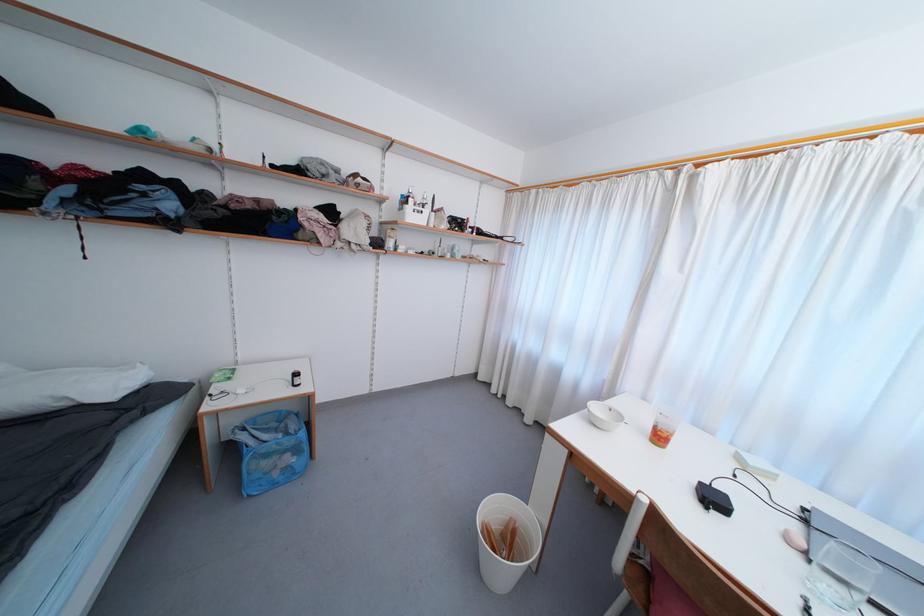
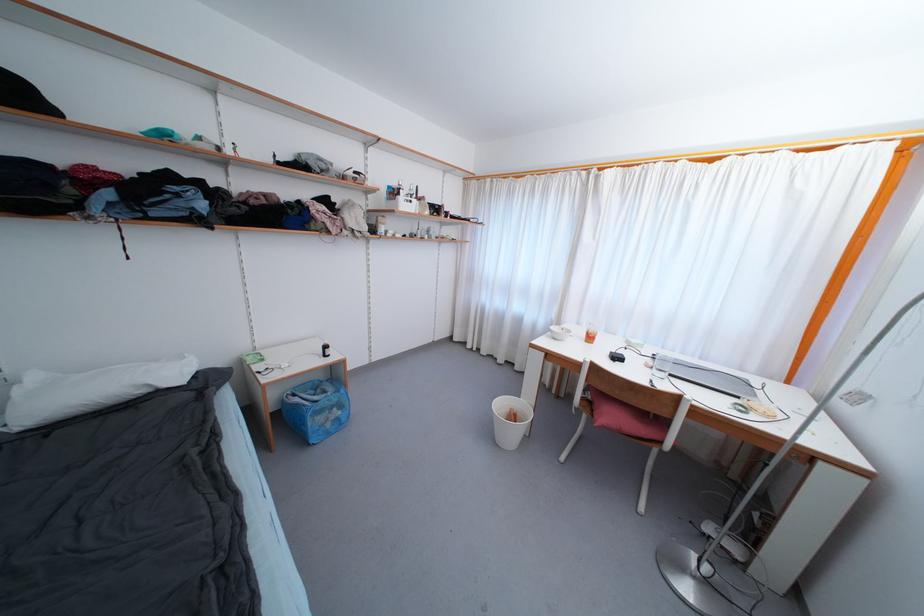
In the second image, find the point that corresponds to point (247, 431) in the first image.

(298, 398)